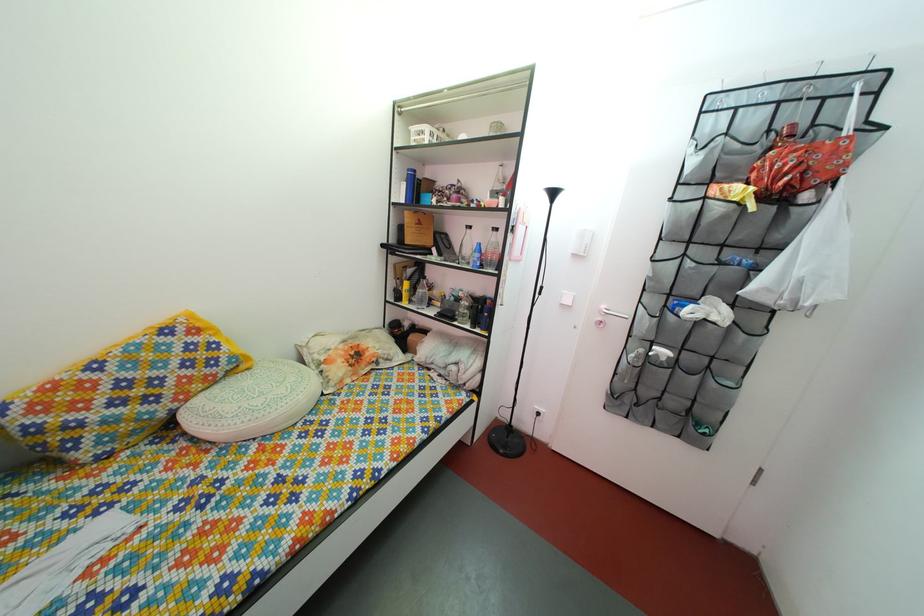
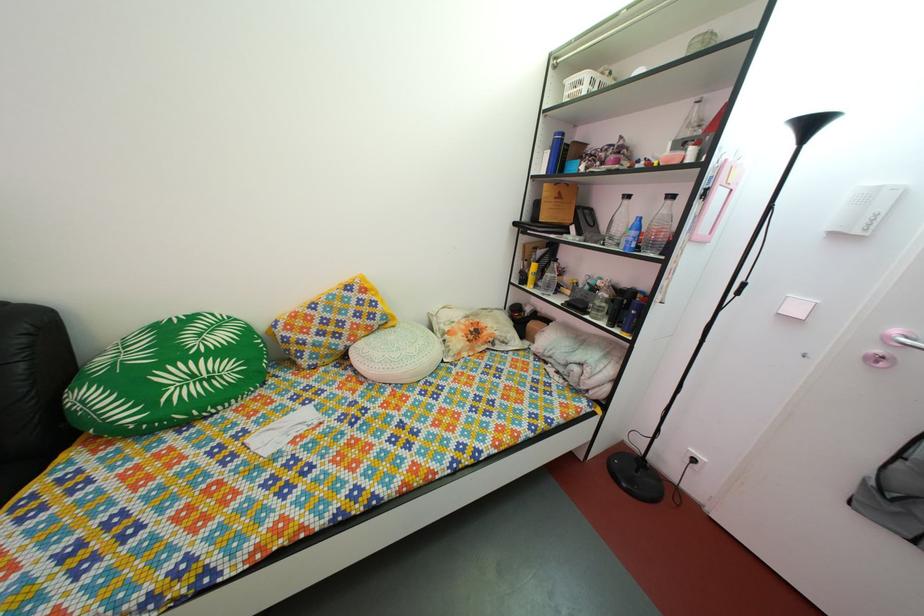
Question: Which direction would the cameraman need to move to produce the second image? Reply with the corresponding letter.

Choices:
 (A) Left
 (B) Right
 (C) Forward
 (D) Backward

Answer: (C)